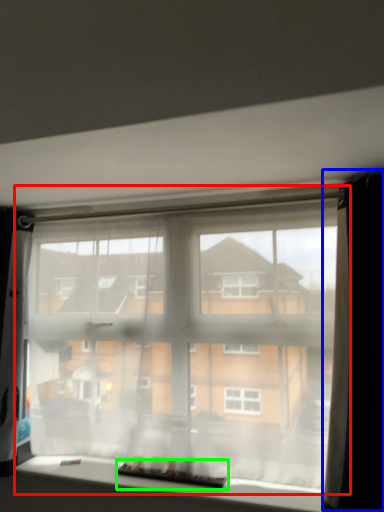
Question: Which object is positioned farthest from window (highlighted by a red box)? Select from curtain (highlighted by a blue box) and level (highlighted by a green box).

Choices:
 (A) curtain
 (B) level

Answer: (A)